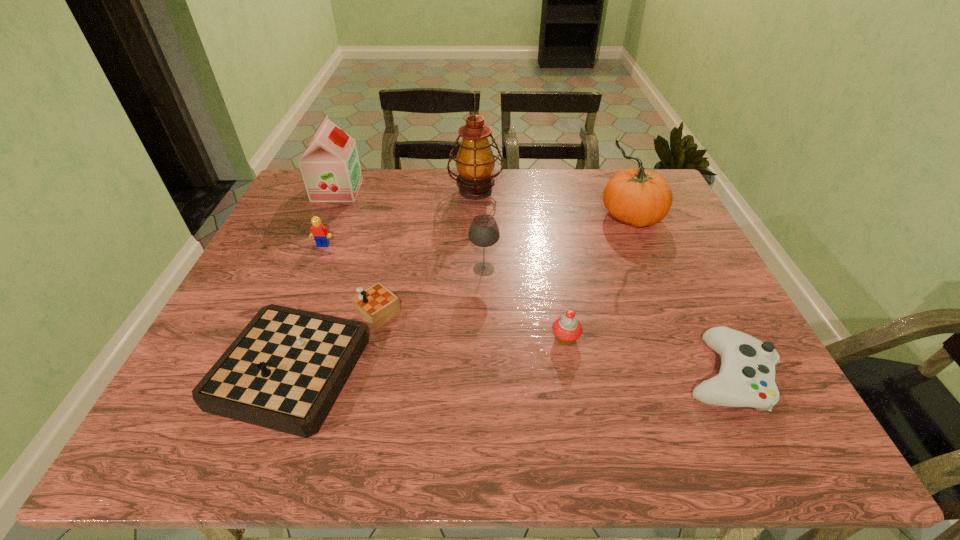
Where is `free region that satisfies the following two spatial constraints: 1. with the cap open on the third tallest object; 2. on the back side of the shortest object`? The width and height of the screenshot is (960, 540). free region that satisfies the following two spatial constraints: 1. with the cap open on the third tallest object; 2. on the back side of the shortest object is located at coordinates (256, 375).

This screenshot has height=540, width=960. I want to click on blank space that satisfies the following two spatial constraints: 1. with the cap open on the soya milk; 2. on the back side of the fifth shortest object, so 302,269.

You are a GUI agent. You are given a task and a screenshot of the screen. Output one action in this format:
    pyautogui.click(x=<x>, y=<y>)
    Task: Click on the free spot that satisfies the following two spatial constraints: 1. on the front side of the third object from right to left; 2. on the right side of the shortest object
    
    Given the screenshot: What is the action you would take?
    pyautogui.click(x=572, y=375)

In order to click on free space that satisfies the following two spatial constraints: 1. with the cap open on the fifth shortest object; 2. on the left side of the sixth shortest object in this screenshot , I will do `click(302, 269)`.